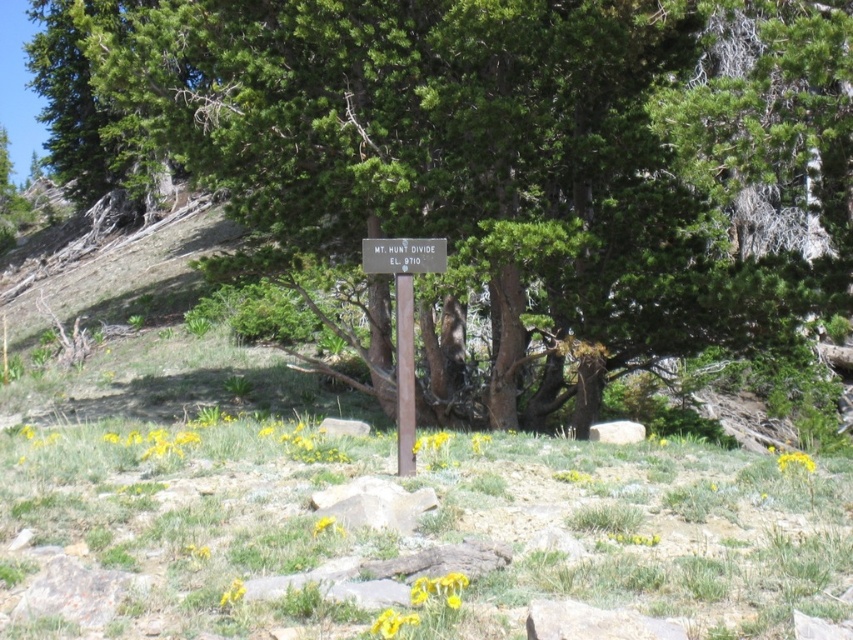
Who is lower down, green grassy at center or wooden sign at center?

green grassy at center is below.

Is green grassy at center positioned at the back of wooden sign at center?

No, it is in front of wooden sign at center.

What do you see at coordinates (412, 538) in the screenshot?
I see `green grassy at center` at bounding box center [412, 538].

Locate an element on the screen. The width and height of the screenshot is (853, 640). green grassy at center is located at coordinates (412, 538).

Can you confirm if green textured tree at center is thinner than green grassy at center?

No.

The height and width of the screenshot is (640, 853). Describe the element at coordinates (494, 154) in the screenshot. I see `green textured tree at center` at that location.

Find the location of `green textured tree at center`. green textured tree at center is located at coordinates (494, 154).

Does green textured tree at center appear on the right side of wooden sign at center?

No, green textured tree at center is not to the right of wooden sign at center.

Locate an element on the screen. Image resolution: width=853 pixels, height=640 pixels. green textured tree at center is located at coordinates (494, 154).